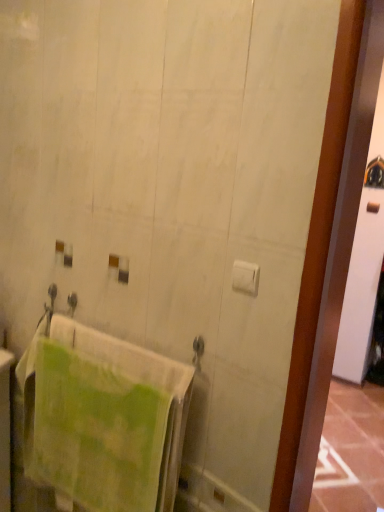
Describe the element at coordinates (92, 430) in the screenshot. I see `green textured towel at lower left` at that location.

Find the location of a particular element. The height and width of the screenshot is (512, 384). green textured towel at lower left is located at coordinates (92, 430).

The image size is (384, 512). What do you see at coordinates (245, 277) in the screenshot? I see `white matte toilet paper at center-right` at bounding box center [245, 277].

What is the approximate height of white matte toilet paper at center-right?

The height of white matte toilet paper at center-right is 3.22 inches.

At what (x,y) coordinates should I click in order to perform the action: click on white matte toilet paper at center-right. Please return your answer as a coordinate pair (x, y). Looking at the image, I should click on (245, 277).

In order to click on green textured towel at lower left in this screenshot , I will do `click(92, 430)`.

Consider the image. Considering the relative positions of white matte toilet paper at center-right and green textured towel at lower left in the image provided, is white matte toilet paper at center-right to the left of green textured towel at lower left from the viewer's perspective?

No, white matte toilet paper at center-right is not to the left of green textured towel at lower left.

Is the depth of white matte toilet paper at center-right greater than that of green textured towel at lower left?

No, the depth of white matte toilet paper at center-right is less than that of green textured towel at lower left.

Considering the points (238, 274) and (60, 467), which point is in front, point (238, 274) or point (60, 467)?

Positioned in front is point (238, 274).

From the image's perspective, would you say white matte toilet paper at center-right is shown under green textured towel at lower left?

Actually, white matte toilet paper at center-right appears above green textured towel at lower left in the image.

From a real-world perspective, is white matte toilet paper at center-right below green textured towel at lower left?

No, from a real-world perspective, white matte toilet paper at center-right is not beneath green textured towel at lower left.

Which of these two, white matte toilet paper at center-right or green textured towel at lower left, is thinner?

white matte toilet paper at center-right.

Who is taller, white matte toilet paper at center-right or green textured towel at lower left?

Standing taller between the two is green textured towel at lower left.

Which of these two, white matte toilet paper at center-right or green textured towel at lower left, is smaller?

With smaller size is white matte toilet paper at center-right.

Would you say white matte toilet paper at center-right is inside or outside green textured towel at lower left?

white matte toilet paper at center-right is not enclosed by green textured towel at lower left.

Is white matte toilet paper at center-right beside green textured towel at lower left?

No, white matte toilet paper at center-right is not touching green textured towel at lower left.

Is white matte toilet paper at center-right aimed at green textured towel at lower left?

No.

How different are the orientations of white matte toilet paper at center-right and green textured towel at lower left in degrees?

The facing directions of white matte toilet paper at center-right and green textured towel at lower left are 10.8 degrees apart.

How much distance is there between white matte toilet paper at center-right and green textured towel at lower left?

27.09 inches.

Image resolution: width=384 pixels, height=512 pixels. Identify the location of toilet paper located above the green textured towel at lower left (from a real-world perspective). (245, 277).

Which object is positioned more to the right, green textured towel at lower left or white matte toilet paper at center-right?

white matte toilet paper at center-right is more to the right.

Is green textured towel at lower left in front of or behind white matte toilet paper at center-right in the image?

Clearly, green textured towel at lower left is behind white matte toilet paper at center-right.

Is point (133, 505) behind point (256, 267)?

Yes, it is.

From the image's perspective, which one is positioned higher, green textured towel at lower left or white matte toilet paper at center-right?

white matte toilet paper at center-right.

From a real-world perspective, is green textured towel at lower left physically above white matte toilet paper at center-right?

Actually, green textured towel at lower left is physically below white matte toilet paper at center-right in the real world.

In terms of width, does green textured towel at lower left look wider or thinner when compared to white matte toilet paper at center-right?

Clearly, green textured towel at lower left has more width compared to white matte toilet paper at center-right.

Between green textured towel at lower left and white matte toilet paper at center-right, which one has less height?

Standing shorter between the two is white matte toilet paper at center-right.

Considering the sizes of objects green textured towel at lower left and white matte toilet paper at center-right in the image provided, who is bigger, green textured towel at lower left or white matte toilet paper at center-right?

Bigger between the two is green textured towel at lower left.

Is green textured towel at lower left located outside white matte toilet paper at center-right?

Yes, green textured towel at lower left is not within white matte toilet paper at center-right.

Can you see green textured towel at lower left touching white matte toilet paper at center-right?

They are not placed beside each other.

Could you tell me if green textured towel at lower left is facing white matte toilet paper at center-right?

No, green textured towel at lower left is not turned towards white matte toilet paper at center-right.

How much distance is there between green textured towel at lower left and white matte toilet paper at center-right?

The distance of green textured towel at lower left from white matte toilet paper at center-right is 27.09 inches.

Find the location of a particular element. The image size is (384, 512). toilet paper on the right of green textured towel at lower left is located at coordinates (245, 277).

Identify the location of toilet paper on the right side of green textured towel at lower left. (245, 277).

You are a GUI agent. You are given a task and a screenshot of the screen. Output one action in this format:
    pyautogui.click(x=<x>, y=<y>)
    Task: Click on the towel that appears behind the white matte toilet paper at center-right
    The width and height of the screenshot is (384, 512).
    Given the screenshot: What is the action you would take?
    pyautogui.click(x=92, y=430)